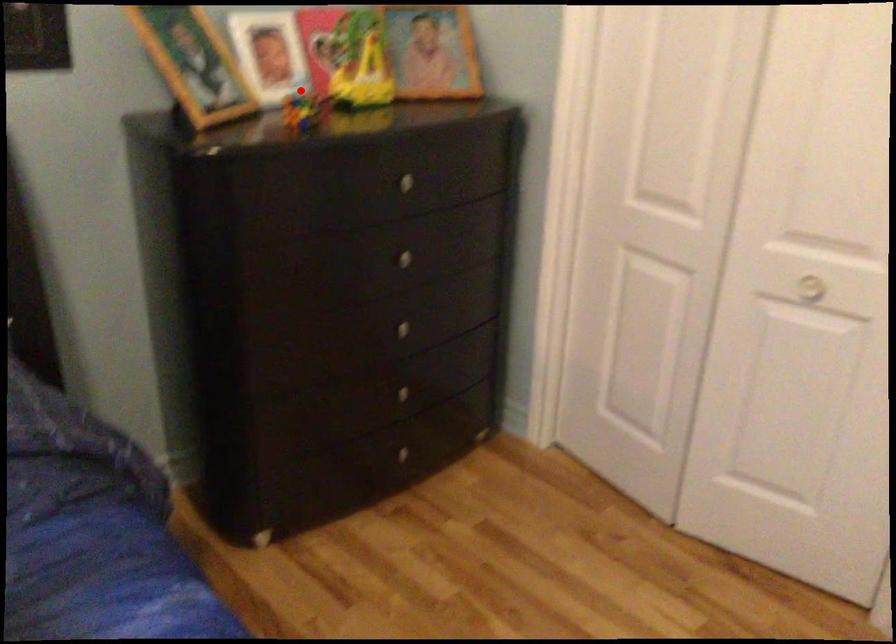
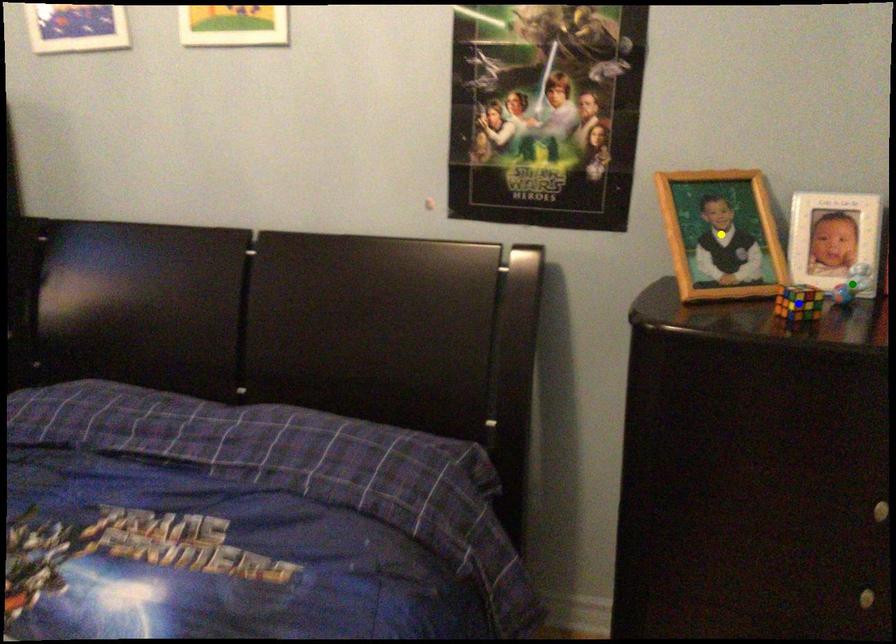
Question: I am providing you with two images of the same scene from different viewpoints. A red point is marked on the first image. You are given multiple points on the second image. Which spot in image 2 lines up with the point in image 1?

Choices:
 (A) green point
 (B) yellow point
 (C) blue point

Answer: (A)